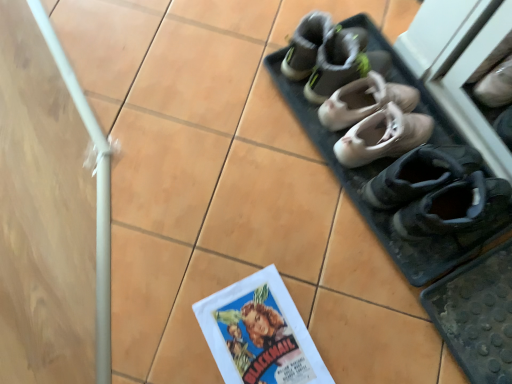
Question: Considering the relative sizes of light beige leather ballet shoes at center, the third footwear in the bottom-to-top sequence, and gray fabric shoes at upper center in the image provided, is light beige leather ballet shoes at center, the third footwear in the bottom-to-top sequence, bigger than gray fabric shoes at upper center?

Choices:
 (A) no
 (B) yes

Answer: (A)

Question: Is light beige leather ballet shoes at center, the 3th footwear viewed from the top, far away from gray fabric shoes at upper center?

Choices:
 (A) no
 (B) yes

Answer: (A)

Question: Can you confirm if light beige leather ballet shoes at center, the third footwear in the bottom-to-top sequence, is taller than gray fabric shoes at upper center?

Choices:
 (A) no
 (B) yes

Answer: (A)

Question: From the image's perspective, is light beige leather ballet shoes at center, the third footwear in the bottom-to-top sequence, below gray fabric shoes at upper center?

Choices:
 (A) no
 (B) yes

Answer: (B)

Question: Is light beige leather ballet shoes at center, the third footwear in the bottom-to-top sequence, with gray fabric shoes at upper center?

Choices:
 (A) no
 (B) yes

Answer: (A)

Question: Can you confirm if light beige leather ballet shoes at center, the third footwear in the bottom-to-top sequence, is wider than gray fabric shoes at upper center?

Choices:
 (A) no
 (B) yes

Answer: (B)

Question: Is gray fabric shoes at upper center positioned before black suede shoes at lower right, positioned as the 1th footwear in bottom-to-top order?

Choices:
 (A) yes
 (B) no

Answer: (B)

Question: Are gray fabric shoes at upper center and black suede shoes at lower right, the fifth footwear from the top, beside each other?

Choices:
 (A) no
 (B) yes

Answer: (A)

Question: Is black suede shoes at lower right, the fifth footwear from the top, a part of gray fabric shoes at upper center?

Choices:
 (A) no
 (B) yes

Answer: (A)

Question: Are gray fabric shoes at upper center and black suede shoes at lower right, positioned as the 1th footwear in bottom-to-top order, located far from each other?

Choices:
 (A) yes
 (B) no

Answer: (B)

Question: Is gray fabric shoes at upper center turned away from black suede shoes at lower right, positioned as the 1th footwear in bottom-to-top order?

Choices:
 (A) no
 (B) yes

Answer: (A)

Question: Does gray fabric shoes at upper center have a greater width compared to black suede shoes at lower right, positioned as the 1th footwear in bottom-to-top order?

Choices:
 (A) no
 (B) yes

Answer: (A)

Question: Can you confirm if matte paper comic book at lower center is positioned to the left of gray suede sneakers at upper center, which is the fifth footwear in bottom-to-top order?

Choices:
 (A) yes
 (B) no

Answer: (A)